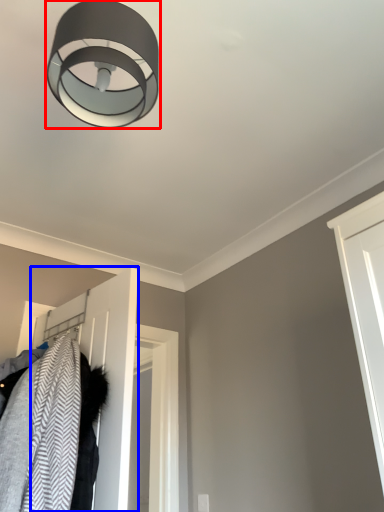
Question: Which point is closer to the camera, lamp (highlighted by a red box) or door (highlighted by a blue box)?

Choices:
 (A) lamp
 (B) door

Answer: (A)